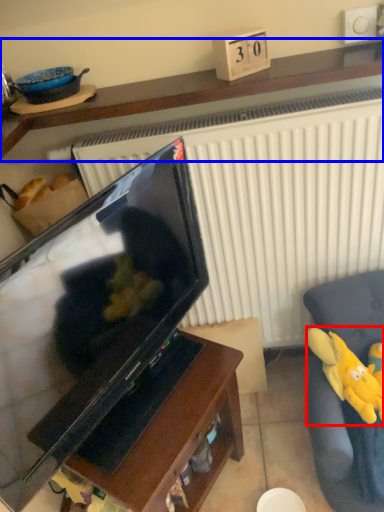
Question: Which object is closer to the camera taking this photo, toy (highlighted by a red box) or furniture (highlighted by a blue box)?

Choices:
 (A) toy
 (B) furniture

Answer: (B)